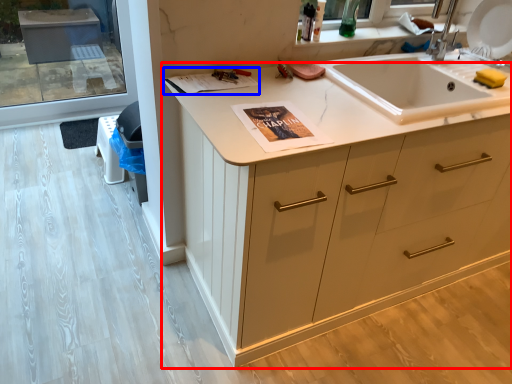
Question: Which point is closer to the camera, cabinetry (highlighted by a red box) or magazine (highlighted by a blue box)?

Choices:
 (A) cabinetry
 (B) magazine

Answer: (A)